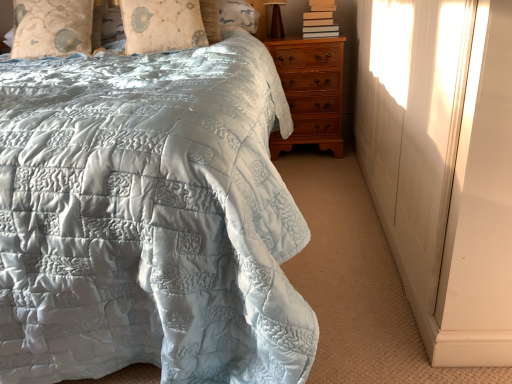
Find the location of a particular element. This screenshot has width=512, height=384. free spot above light brown wood chest of drawers at right (from a real-world perspective) is located at coordinates (303, 36).